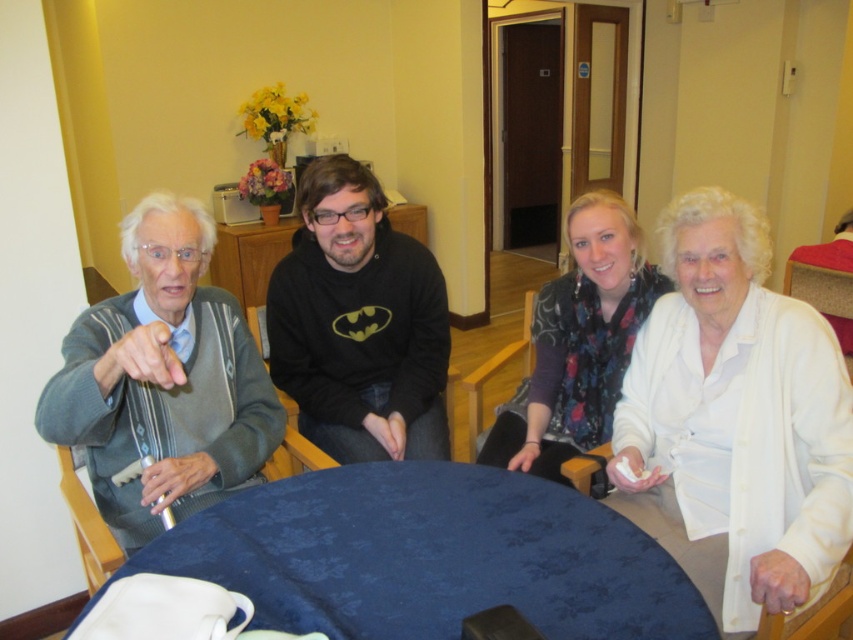
Which is below, gray striped sweater at left or floral scarf at center?

Positioned lower is gray striped sweater at left.

Can you confirm if gray striped sweater at left is taller than floral scarf at center?

Correct, gray striped sweater at left is much taller as floral scarf at center.

What are the coordinates of `gray striped sweater at left` in the screenshot? It's located at (163, 380).

Who is higher up, white matte cardigan at right or gray striped sweater at left?

gray striped sweater at left

Is point (766, 456) less distant than point (207, 435)?

Yes, it is in front of point (207, 435).

Image resolution: width=853 pixels, height=640 pixels. What are the coordinates of `white matte cardigan at right` in the screenshot? It's located at (735, 420).

Consider the image. Does white matte cardigan at right have a lesser width compared to black cotton hoodie at center?

Yes, white matte cardigan at right is thinner than black cotton hoodie at center.

Is white matte cardigan at right to the right of black cotton hoodie at center from the viewer's perspective?

Yes, white matte cardigan at right is to the right of black cotton hoodie at center.

You are a GUI agent. You are given a task and a screenshot of the screen. Output one action in this format:
    pyautogui.click(x=<x>, y=<y>)
    Task: Click on the white matte cardigan at right
    The image size is (853, 640).
    Given the screenshot: What is the action you would take?
    pyautogui.click(x=735, y=420)

At what (x,y) coordinates should I click in order to perform the action: click on white matte cardigan at right. Please return your answer as a coordinate pair (x, y). Looking at the image, I should click on (735, 420).